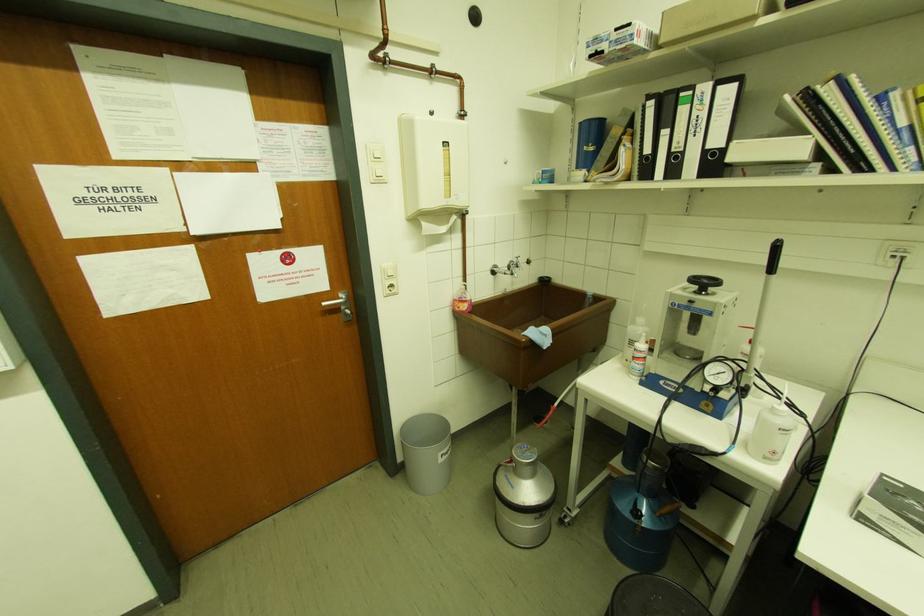
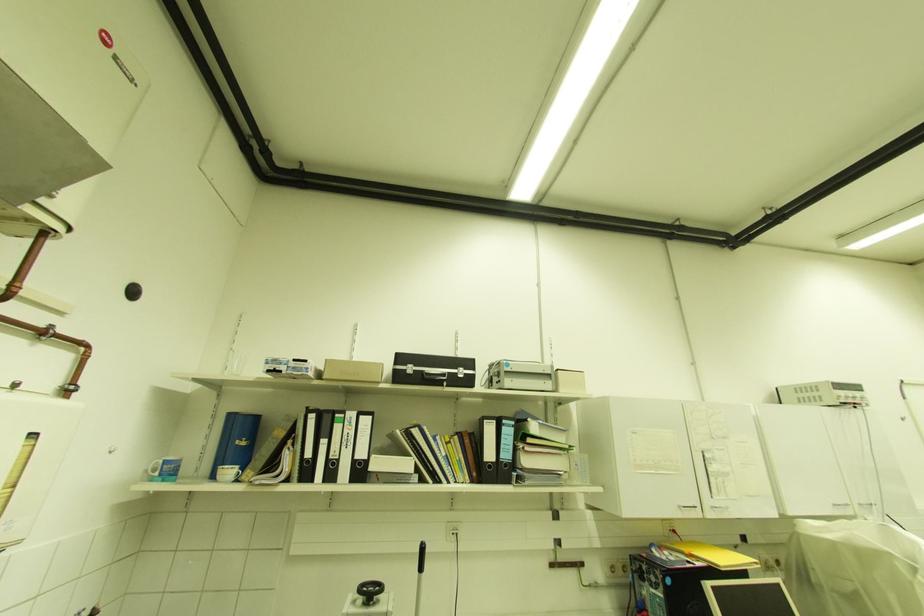
Consider the image. Based on the continuous images, in which direction is the camera rotating?

The camera's rotation is toward right-up.